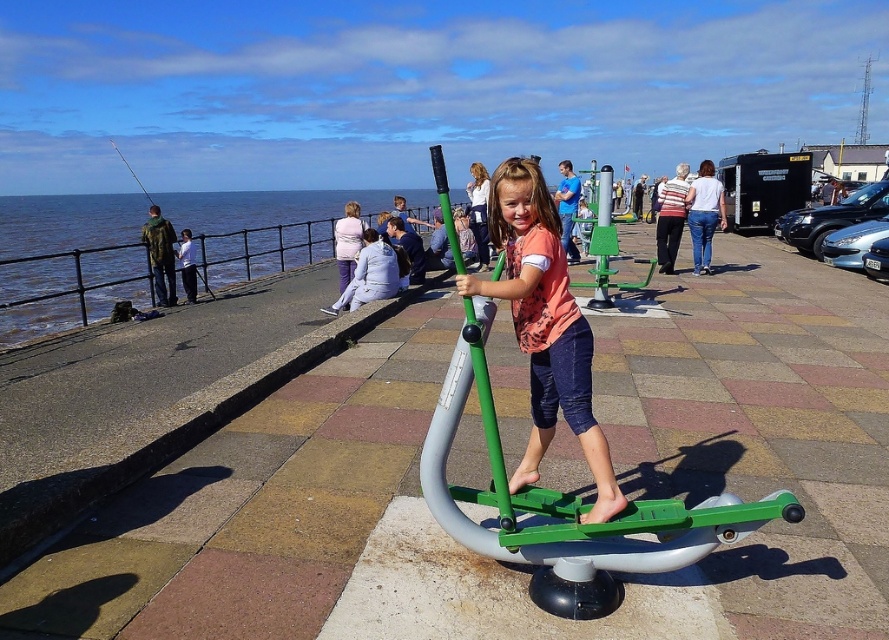
Question: Can you confirm if matte orange shirt at center is bigger than green matte pole at center?

Choices:
 (A) yes
 (B) no

Answer: (A)

Question: Which of the following is the closest to the observer?

Choices:
 (A) matte orange shirt at center
 (B) green matte pole at center

Answer: (B)

Question: Can you confirm if matte orange shirt at center is positioned to the left of green matte pole at center?

Choices:
 (A) yes
 (B) no

Answer: (B)

Question: Where is matte orange shirt at center located in relation to green matte pole at center in the image?

Choices:
 (A) left
 (B) right

Answer: (B)